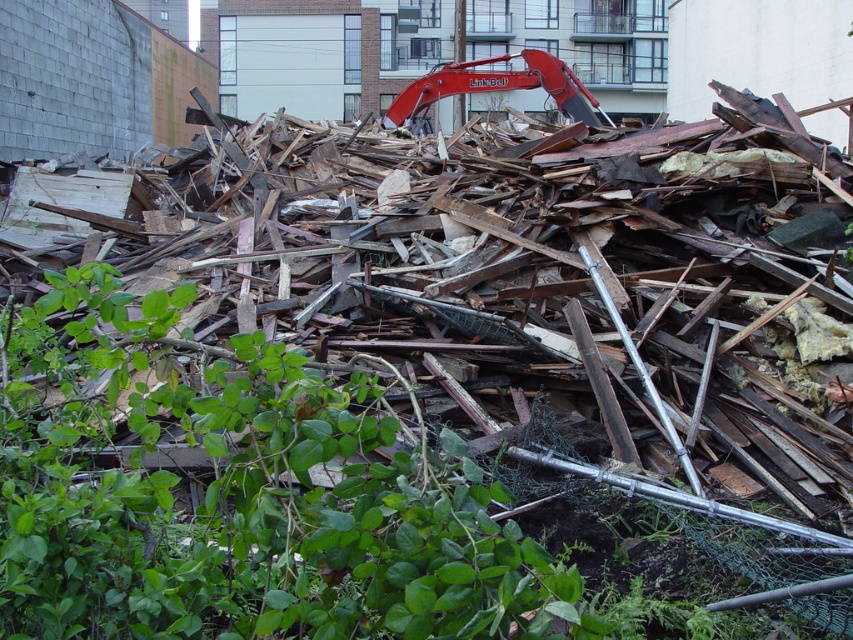
Does green leafy plant at lower left have a lesser height compared to red metal excavator at upper center?

Yes.

Which is more to the left, green leafy plant at lower left or red metal excavator at upper center?

green leafy plant at lower left

Is point (251, 348) behind point (397, 122)?

No, (251, 348) is in front of (397, 122).

Find the location of `green leafy plant at lower left`. green leafy plant at lower left is located at coordinates (241, 499).